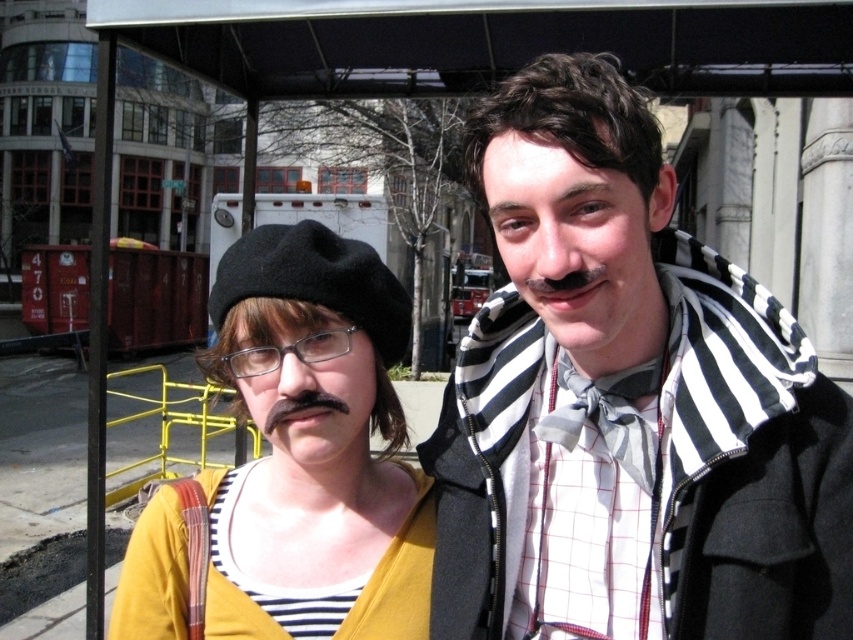
Question: Can you confirm if striped scarf at center is wider than yellow striped shirt at center?

Choices:
 (A) yes
 (B) no

Answer: (A)

Question: Can you confirm if striped scarf at center is bigger than clear plastic glasses at center?

Choices:
 (A) yes
 (B) no

Answer: (A)

Question: Which point appears closest to the camera in this image?

Choices:
 (A) (833, 604)
 (B) (321, 620)

Answer: (A)

Question: Which of the following is the closest to the observer?

Choices:
 (A) (717, 426)
 (B) (273, 369)
 (C) (271, 577)

Answer: (A)

Question: From the image, what is the correct spatial relationship of striped scarf at center in relation to clear plastic glasses at center?

Choices:
 (A) below
 (B) above

Answer: (B)

Question: Which point is farther to the camera?

Choices:
 (A) yellow striped shirt at center
 (B) striped scarf at center

Answer: (A)